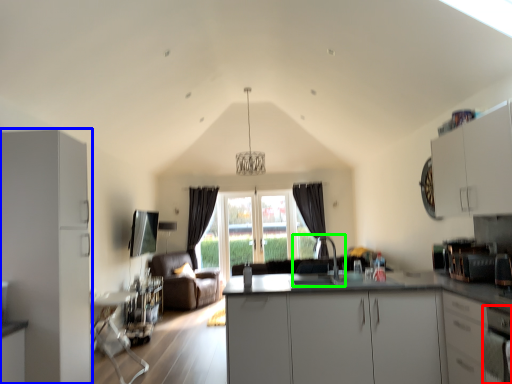
Question: Which is farther away from oven (highlighted by a red box)? cabinetry (highlighted by a blue box) or sink (highlighted by a green box)?

Choices:
 (A) cabinetry
 (B) sink

Answer: (B)